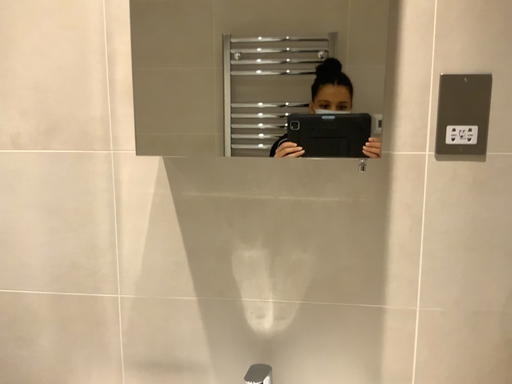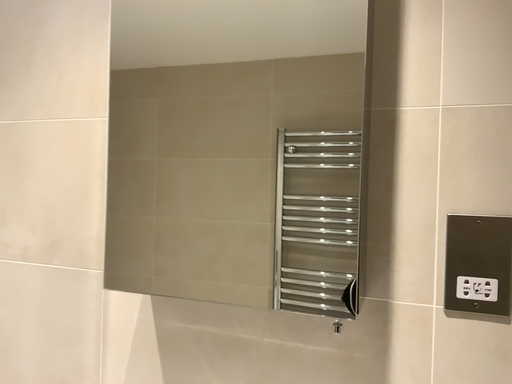
Question: How did the camera likely rotate when shooting the video?

Choices:
 (A) rotated left
 (B) rotated right

Answer: (A)